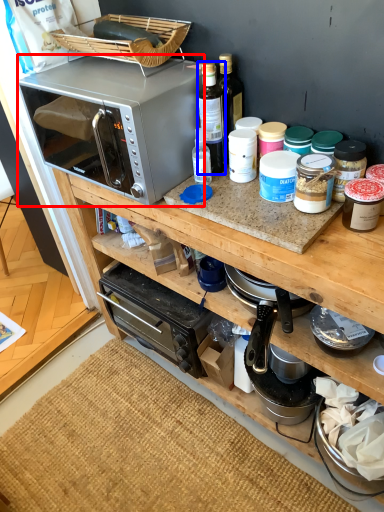
Question: Which object appears closest to the camera in this image, microwave oven (highlighted by a red box) or bottle (highlighted by a blue box)?

Choices:
 (A) microwave oven
 (B) bottle

Answer: (A)